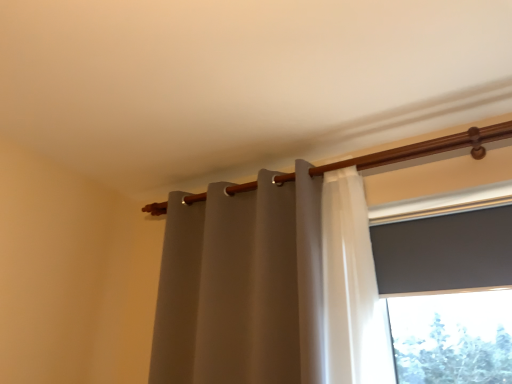
Where is `wooden curtain rod at upper center`? Image resolution: width=512 pixels, height=384 pixels. wooden curtain rod at upper center is located at coordinates (426, 148).

The image size is (512, 384). What do you see at coordinates (444, 252) in the screenshot?
I see `matte gray screen at upper right` at bounding box center [444, 252].

The width and height of the screenshot is (512, 384). I want to click on matte gray screen at upper right, so click(444, 252).

What do you see at coordinates (243, 284) in the screenshot? The width and height of the screenshot is (512, 384). I see `matte gray curtain at center` at bounding box center [243, 284].

In order to click on wooden curtain rod at upper center in this screenshot , I will do `click(426, 148)`.

Which object is wider, matte gray screen at upper right or wooden curtain rod at upper center?

wooden curtain rod at upper center is wider.

Based on the photo, is matte gray screen at upper right oriented away from wooden curtain rod at upper center?

No, matte gray screen at upper right's orientation is not away from wooden curtain rod at upper center.

Relative to wooden curtain rod at upper center, is matte gray screen at upper right in front or behind?

In the image, matte gray screen at upper right appears in front of wooden curtain rod at upper center.

Which is behind, point (377, 269) or point (227, 255)?

The point (227, 255) is farther.

Is matte gray screen at upper right outside of matte gray curtain at center?

matte gray screen at upper right is positioned outside matte gray curtain at center.

Considering the relative positions of matte gray screen at upper right and matte gray curtain at center in the image provided, is matte gray screen at upper right to the left of matte gray curtain at center from the viewer's perspective?

In fact, matte gray screen at upper right is to the right of matte gray curtain at center.

Is matte gray screen at upper right touching matte gray curtain at center?

No, matte gray screen at upper right is not touching matte gray curtain at center.

Is matte gray curtain at center completely or partially outside of matte gray screen at upper right?

matte gray curtain at center is positioned outside matte gray screen at upper right.

How many degrees apart are the facing directions of matte gray curtain at center and matte gray screen at upper right?

They differ by 1.51 degrees in their facing directions.

Is matte gray curtain at center turned away from matte gray screen at upper right?

matte gray curtain at center is not turned away from matte gray screen at upper right.

Is matte gray curtain at center bigger or smaller than matte gray screen at upper right?

Clearly, matte gray curtain at center is larger in size than matte gray screen at upper right.

Could you tell me if matte gray curtain at center is turned towards wooden curtain rod at upper center?

Yes, matte gray curtain at center is turned towards wooden curtain rod at upper center.

Which is closer to the camera, (x=323, y=312) or (x=490, y=128)?

Point (x=323, y=312) is positioned closer to the camera compared to point (x=490, y=128).

At what (x,y) coordinates should I click in order to perform the action: click on curtain below the wooden curtain rod at upper center (from the image's perspective). Please return your answer as a coordinate pair (x, y). Looking at the image, I should click on (243, 284).

From the image's perspective, is matte gray curtain at center located beneath wooden curtain rod at upper center?

Yes.

Is wooden curtain rod at upper center placed right next to matte gray curtain at center?

No, wooden curtain rod at upper center is not making contact with matte gray curtain at center.

Locate an element on the screen. The width and height of the screenshot is (512, 384). curtain that is below the wooden curtain rod at upper center (from the image's perspective) is located at coordinates tap(243, 284).

Considering the relative sizes of wooden curtain rod at upper center and matte gray curtain at center in the image provided, is wooden curtain rod at upper center wider than matte gray curtain at center?

Incorrect, the width of wooden curtain rod at upper center does not surpass that of matte gray curtain at center.

Can you confirm if wooden curtain rod at upper center is shorter than matte gray screen at upper right?

Correct, wooden curtain rod at upper center is not as tall as matte gray screen at upper right.

Is wooden curtain rod at upper center aimed at matte gray screen at upper right?

No, wooden curtain rod at upper center does not turn towards matte gray screen at upper right.

Considering the sizes of objects wooden curtain rod at upper center and matte gray screen at upper right in the image provided, who is smaller, wooden curtain rod at upper center or matte gray screen at upper right?

wooden curtain rod at upper center.

Looking at this image, how far apart are wooden curtain rod at upper center and matte gray screen at upper right?

A distance of 14.21 inches exists between wooden curtain rod at upper center and matte gray screen at upper right.

The image size is (512, 384). Identify the location of window screen below the wooden curtain rod at upper center (from the image's perspective). (444, 252).

Identify the location of curtain below the matte gray screen at upper right (from a real-world perspective). (243, 284).

Consider the image. Considering their positions, is matte gray screen at upper right positioned closer to wooden curtain rod at upper center than matte gray curtain at center?

matte gray screen at upper right is positioned closer to the anchor wooden curtain rod at upper center.

Based on their spatial positions, is matte gray curtain at center or matte gray screen at upper right closer to wooden curtain rod at upper center?

The object closer to wooden curtain rod at upper center is matte gray screen at upper right.

When comparing their distances from matte gray screen at upper right, does matte gray curtain at center or wooden curtain rod at upper center seem further?

matte gray curtain at center is further to matte gray screen at upper right.

Which object lies nearer to the anchor point matte gray curtain at center, wooden curtain rod at upper center or matte gray screen at upper right?

Based on the image, wooden curtain rod at upper center appears to be nearer to matte gray curtain at center.

From the image, which object appears to be farther from matte gray screen at upper right, wooden curtain rod at upper center or matte gray curtain at center?

matte gray curtain at center is further to matte gray screen at upper right.

From the image, which object appears to be nearer to matte gray curtain at center, matte gray screen at upper right or wooden curtain rod at upper center?

wooden curtain rod at upper center.

Locate an element on the screen. beam between matte gray curtain at center and matte gray screen at upper right is located at coordinates 426,148.